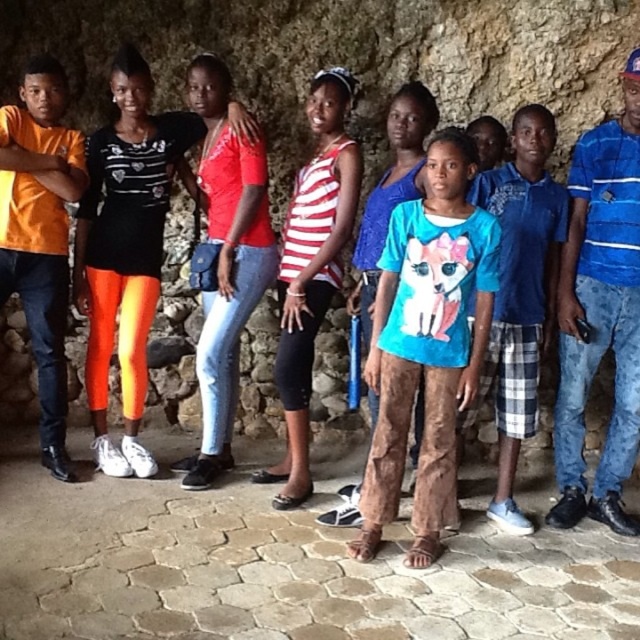
Based on the scene description, which object is taller between the neon orange leggings at center and the blue plaid shorts at center?

The neon orange leggings at center is much taller than the blue plaid shorts at center.

You are standing in front of the group of nine individuals. There are two points marked on the image at coordinates point (x=128, y=376) and point (x=528, y=188). Which point is closer to you?

Point (x=128, y=376) is further to the viewer than point (x=528, y=188), so the closer point to you is point (x=128, y=376).

You are standing in front of the group of nine individuals against the stone wall. You need to find the blue plaid shorts at center. Based on their 2D location coordinates, where exactly should you look to locate them?

The blue plaid shorts at center are located at the 2D coordinates point (520, 291).